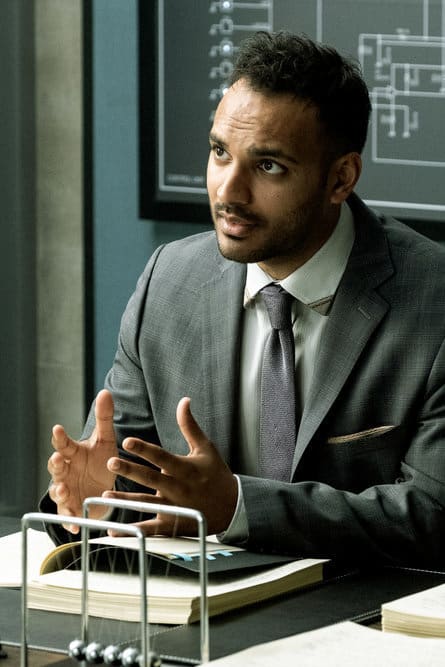
Find the location of `black mat`. black mat is located at coordinates (310, 603).